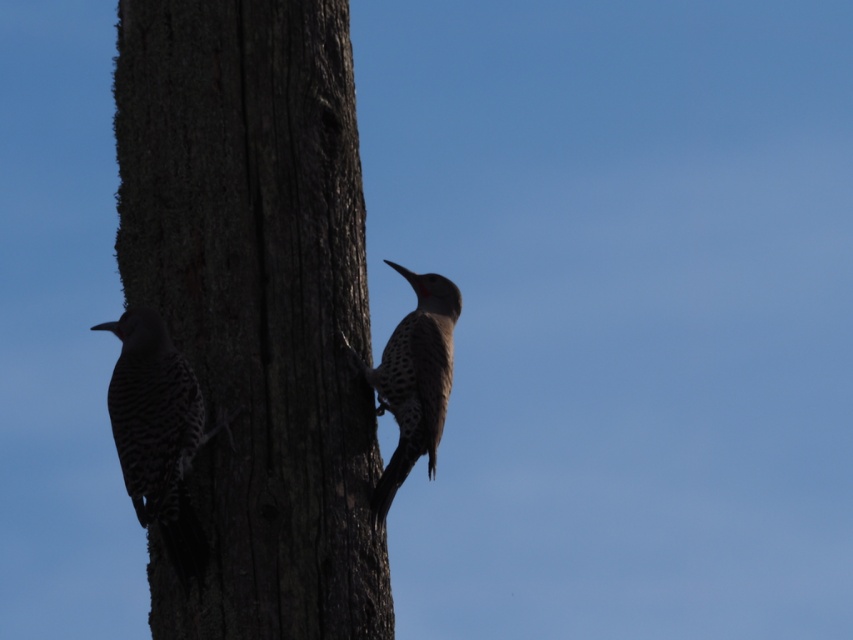
Question: Estimate the real-world distances between objects in this image. Which object is farther from the spotted feathered woodpecker at center?

Choices:
 (A) smooth bark tree trunk at center
 (B) speckled brown woodpecker at left

Answer: (B)

Question: In this image, where is smooth bark tree trunk at center located relative to speckled brown woodpecker at left?

Choices:
 (A) left
 (B) right

Answer: (B)

Question: Observing the image, what is the correct spatial positioning of speckled brown woodpecker at left in reference to spotted feathered woodpecker at center?

Choices:
 (A) right
 (B) left

Answer: (B)

Question: From the image, what is the correct spatial relationship of speckled brown woodpecker at left in relation to spotted feathered woodpecker at center?

Choices:
 (A) right
 (B) left

Answer: (B)

Question: Which point is farther to the camera?

Choices:
 (A) (404, 376)
 (B) (189, 548)

Answer: (A)

Question: Considering the real-world distances, which object is farthest from the spotted feathered woodpecker at center?

Choices:
 (A) smooth bark tree trunk at center
 (B) speckled brown woodpecker at left

Answer: (B)